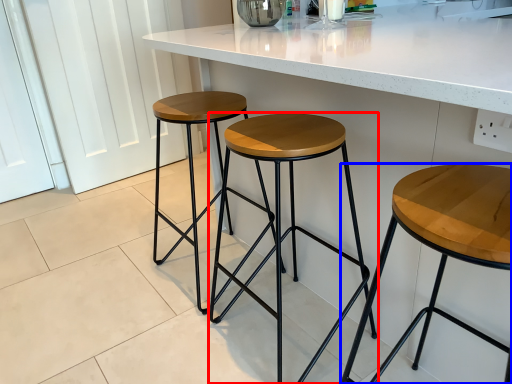
Question: Which of the following is the farthest to the observer, stool (highlighted by a red box) or stool (highlighted by a blue box)?

Choices:
 (A) stool
 (B) stool

Answer: (A)